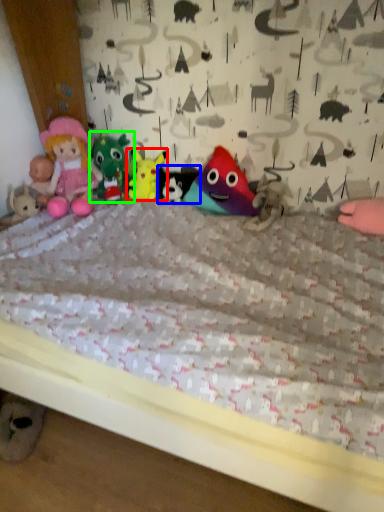
Question: Considering the real-world distances, which object is farthest from toy (highlighted by a red box)? toy (highlighted by a blue box) or toy (highlighted by a green box)?

Choices:
 (A) toy
 (B) toy

Answer: (B)